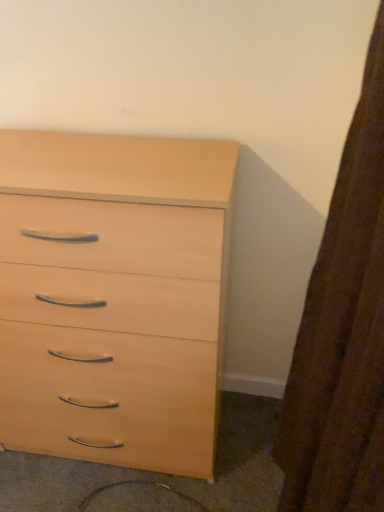
Where is `free space above light wood chest of drawers at center (from a real-world perspective)`? This screenshot has width=384, height=512. free space above light wood chest of drawers at center (from a real-world perspective) is located at coordinates (91, 152).